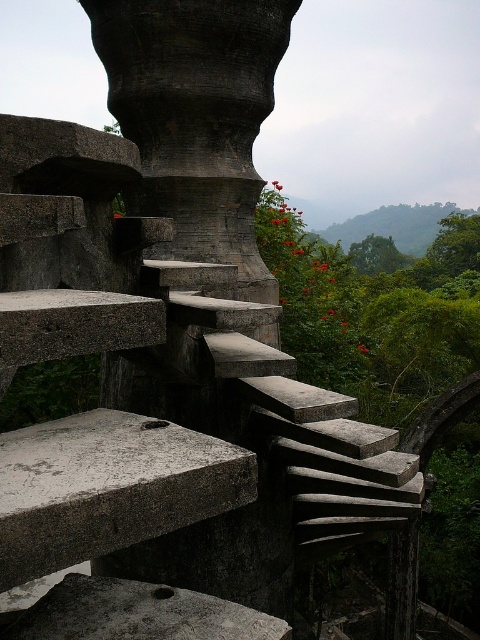
Question: Which point is farther from the camera taking this photo?

Choices:
 (A) (192, 13)
 (B) (15, 557)
 (C) (117, 609)

Answer: (A)

Question: Does dark gray stone pillar at center appear on the left side of gray concrete at lower left?

Choices:
 (A) yes
 (B) no

Answer: (B)

Question: Among these objects, which one is farthest from the camera?

Choices:
 (A) gray concrete stairs at center
 (B) gray concrete at lower left

Answer: (B)

Question: Does dark gray stone pillar at center appear over gray concrete at lower left?

Choices:
 (A) no
 (B) yes

Answer: (B)

Question: Which point is farther from the camera taking this photo?

Choices:
 (A) (181, 588)
 (B) (75, 504)
 (C) (216, 45)

Answer: (C)

Question: Is gray concrete stairs at center wider than gray concrete at lower left?

Choices:
 (A) no
 (B) yes

Answer: (A)